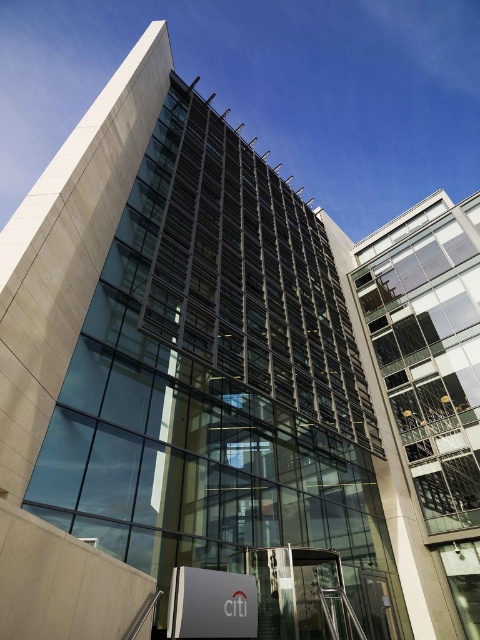
You are standing at the entrance of the building and want to reach the office located on the second floor. The metallic staircase at lower center is the only staircase available. Can you see the clear glass building at right from the staircase?

Yes, because the clear glass building at right is to the right of the metallic staircase at lower center, so when standing on the staircase, you can see the clear glass building at right to your right side.

You are a delivery person trying to determine the best path to the Citibank entrance. You see the clear glass building at right and the metallic staircase at lower center. Which object is closer to the entrance?

The metallic staircase at lower center is closer to the entrance because it is positioned at the lower center, which is typically where entrances are located in such buildings, and the clear glass building at right is taller but likely further away from the entrance area.

Consider the image. You are a delivery person trying to park your 2.5 meter wide truck near the clear glass building at right. The parking spot next to the metallic staircase at lower center is available. Can you fit your truck there without blocking the staircase?

The clear glass building at right is wider than the metallic staircase at lower center. However, the width of the parking spot relative to the staircase isnanot specified. Without knowing the exact dimensions of the parking spot, it is uncertain if the truck will fit without blocking the staircase.